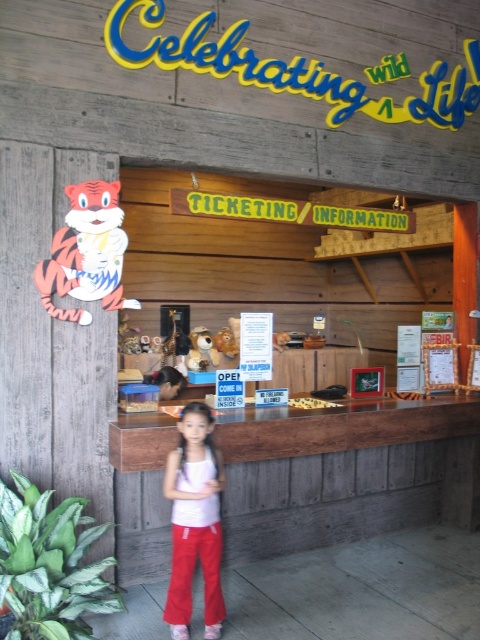
You are a customer at the wildlife attraction and want to buy a souvenir tank top. You see the white fabric tank top at center and the orange paper tiger at left. Which one is smaller in size?

The white fabric tank top at center has a smaller size compared to the orange paper tiger at left, so the white fabric tank top at center is smaller.

Consider the image. You are a visitor at the wildlife attraction and want to read the small informational sign on the counter. The white fabric tank top at center and orange paper tiger at left are in your way. Which object is taller and might block your view of the sign?

The white fabric tank top at center is much taller than the orange paper tiger at left, so it might block your view of the sign.